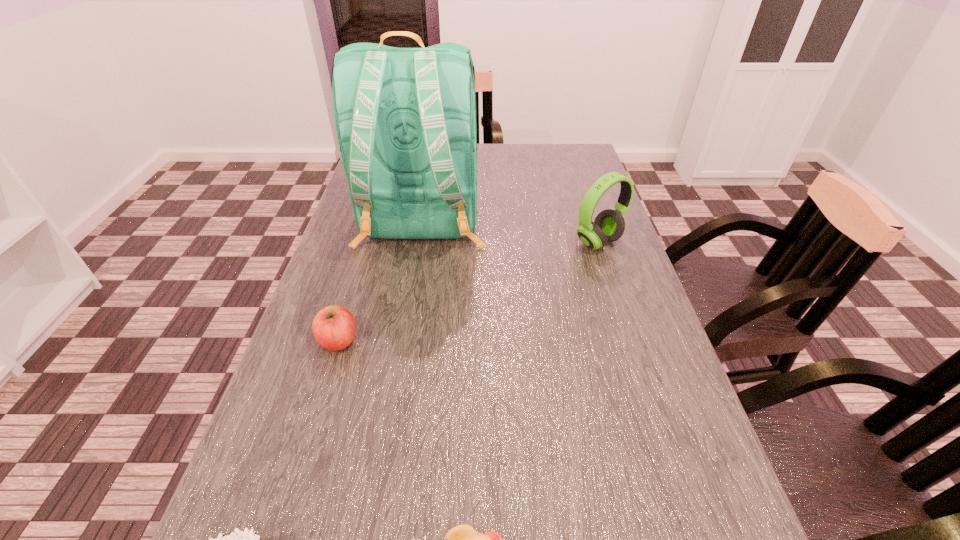
You are a GUI agent. You are given a task and a screenshot of the screen. Output one action in this format:
    pyautogui.click(x=<x>, y=<y>)
    Task: Click on the backpack
    
    Given the screenshot: What is the action you would take?
    pyautogui.click(x=405, y=118)

You are a GUI agent. You are given a task and a screenshot of the screen. Output one action in this format:
    pyautogui.click(x=<x>, y=<y>)
    Task: Click on the second tallest object
    This screenshot has height=540, width=960.
    Given the screenshot: What is the action you would take?
    pyautogui.click(x=609, y=225)

The image size is (960, 540). Find the location of `headset`. headset is located at coordinates (609, 225).

Locate an element on the screen. This screenshot has width=960, height=540. the third nearest object is located at coordinates (334, 327).

The width and height of the screenshot is (960, 540). In order to click on free space located 0.230m on the back of the backpack in this screenshot , I will do `click(402, 342)`.

The height and width of the screenshot is (540, 960). Find the location of `vacant space situated 0.100m on the back of the headset`. vacant space situated 0.100m on the back of the headset is located at coordinates (588, 210).

Locate an element on the screen. blank space located 0.120m on the right of the third farthest object is located at coordinates (416, 340).

The width and height of the screenshot is (960, 540). Identify the location of backpack that is at the left edge. (405, 118).

I want to click on apple at the left edge, so click(334, 327).

Locate an element on the screen. The height and width of the screenshot is (540, 960). object located at the right edge is located at coordinates (609, 225).